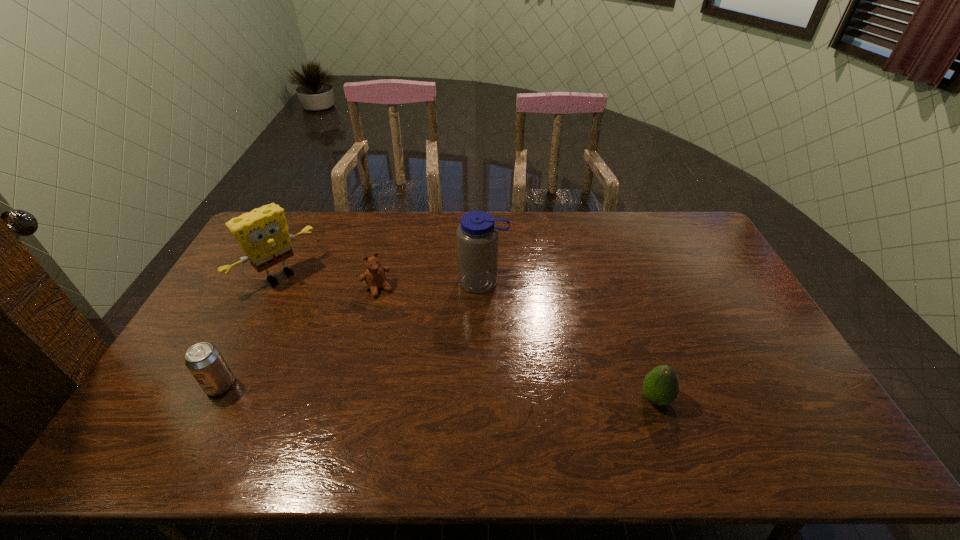
Where is `free space that is in between the second object from right to left and the rightmost object`? Image resolution: width=960 pixels, height=540 pixels. free space that is in between the second object from right to left and the rightmost object is located at coordinates pos(569,340).

What are the coordinates of `empty location between the second object from right to left and the rightmost object` in the screenshot? It's located at (569, 340).

Where is `unoccupied area between the water bottle and the rightmost object`? The image size is (960, 540). unoccupied area between the water bottle and the rightmost object is located at coordinates (569, 340).

At what (x,y) coordinates should I click in order to perform the action: click on free space between the second object from right to left and the beer can. Please return your answer as a coordinate pair (x, y). Image resolution: width=960 pixels, height=540 pixels. Looking at the image, I should click on (351, 334).

Image resolution: width=960 pixels, height=540 pixels. Identify the location of free space between the fourth object from left to right and the beer can. (351, 334).

Locate an element on the screen. object that can be found as the fourth closest to the teddy bear is located at coordinates (660, 386).

At what (x,y) coordinates should I click in order to perform the action: click on object that ranks as the closest to the third object from left to right. Please return your answer as a coordinate pair (x, y). This screenshot has height=540, width=960. Looking at the image, I should click on (262, 234).

Find the location of a particular element. free space in the image that satisfies the following two spatial constraints: 1. on the front side of the beer can; 2. on the right side of the rightmost object is located at coordinates (214, 399).